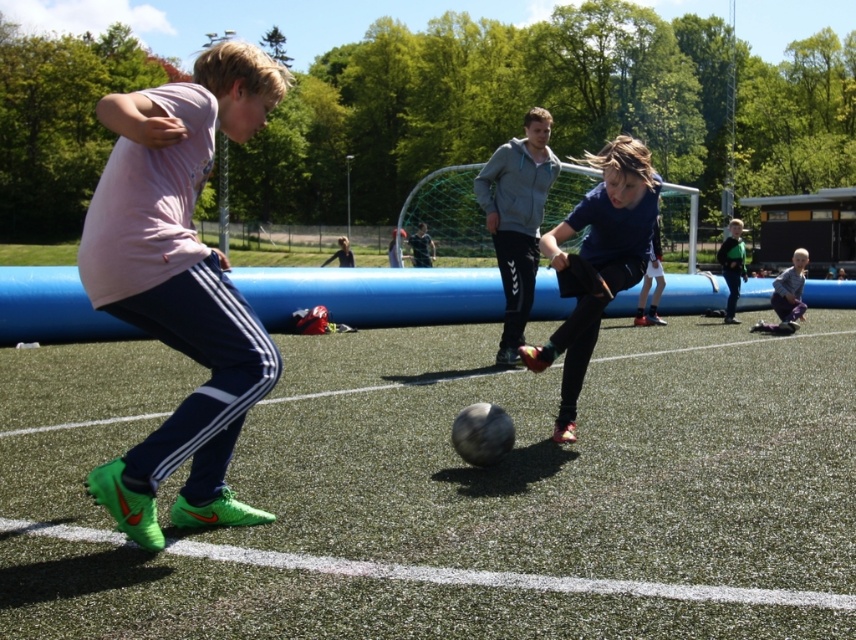
From the picture: You are a soccer coach observing the game. You notice two players wearing matte blue shorts at center and light blue fabric pants at lower right. Which player is closer to the ground?

The matte blue shorts at center is located below light blue fabric pants at lower right, meaning the player wearing matte blue shorts at center is closer to the ground.

You are a photographer standing at the edge of the soccer field. You want to take a photo that includes both the matte blue shorts at center and the light blue fabric pants at lower right. Which object should you focus on first to ensure both are in the frame?

You should focus on the matte blue shorts at center first because it is closer to the viewer than the light blue fabric pants at lower right, so adjusting the camera to include the closer object will naturally include the farther one as well.